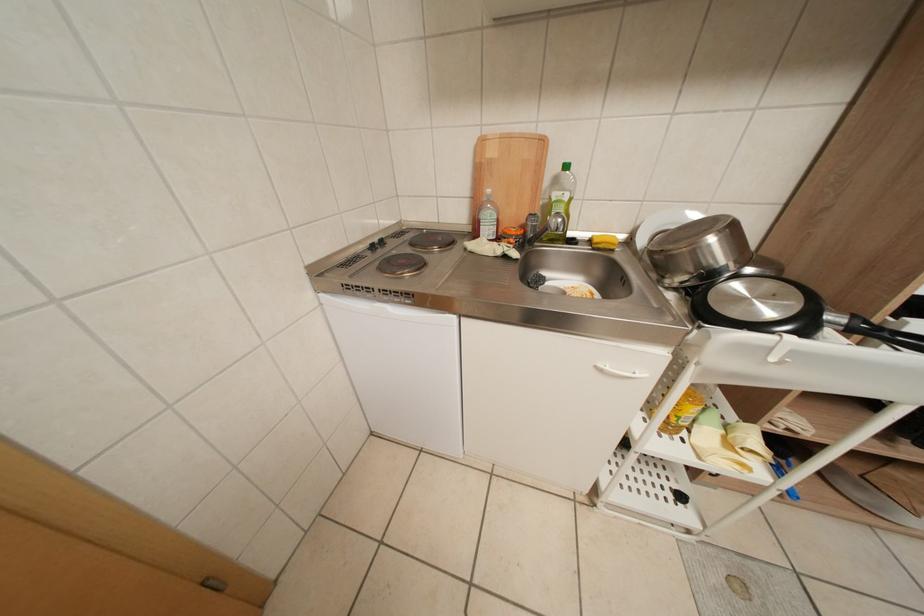
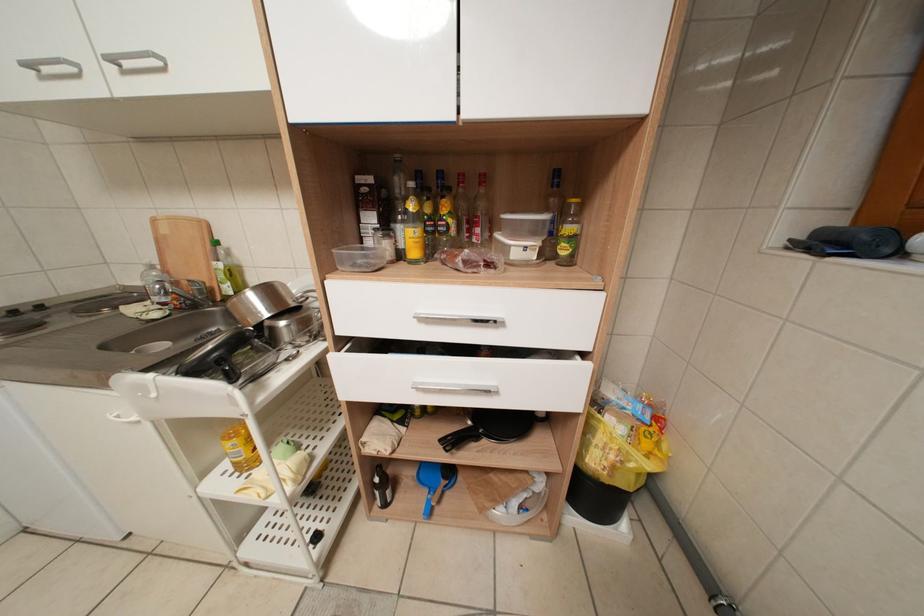
Question: In a continuous first-person perspective shot, in which direction is the camera moving?

Choices:
 (A) Left
 (B) Right
 (C) Forward
 (D) Backward

Answer: (B)